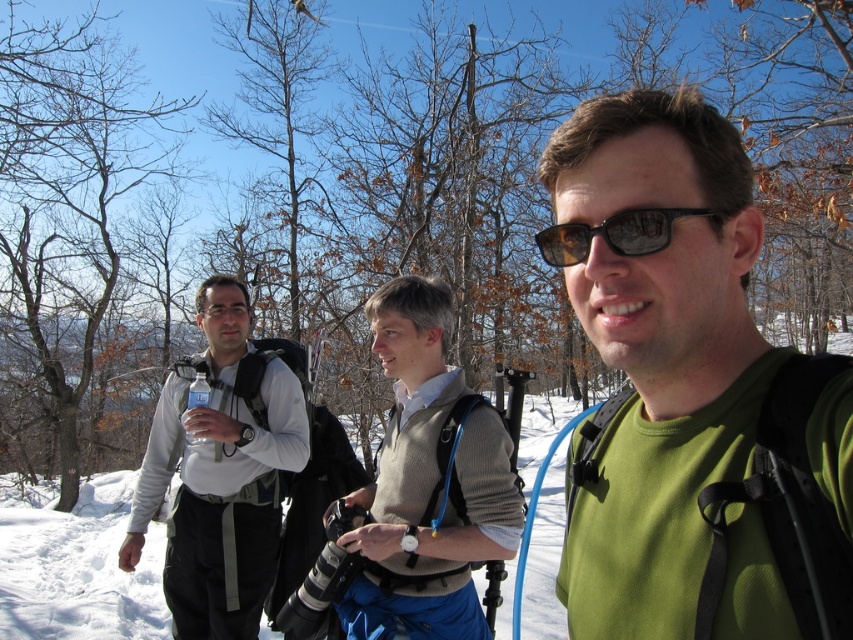
Is knit sweater at center wider than white matte water bottle at left?

No, knit sweater at center is not wider than white matte water bottle at left.

Does knit sweater at center come behind white matte water bottle at left?

No, knit sweater at center is closer to the viewer.

Is point (426, 621) less distant than point (207, 624)?

Yes, it is.

Where is `knit sweater at center`? This screenshot has height=640, width=853. knit sweater at center is located at coordinates (427, 483).

Does knit sweater at center have a greater height compared to black reflective sunglasses at center?

Yes.

Does knit sweater at center appear on the right side of black reflective sunglasses at center?

No, knit sweater at center is not to the right of black reflective sunglasses at center.

Locate an element on the screen. The width and height of the screenshot is (853, 640). knit sweater at center is located at coordinates (427, 483).

Between white matte water bottle at left and black reflective sunglasses at center, which one is positioned lower?

white matte water bottle at left

Is white matte water bottle at left wider than black reflective sunglasses at center?

Yes.

The image size is (853, 640). What do you see at coordinates (218, 474) in the screenshot?
I see `white matte water bottle at left` at bounding box center [218, 474].

Locate an element on the screen. The width and height of the screenshot is (853, 640). white matte water bottle at left is located at coordinates (218, 474).